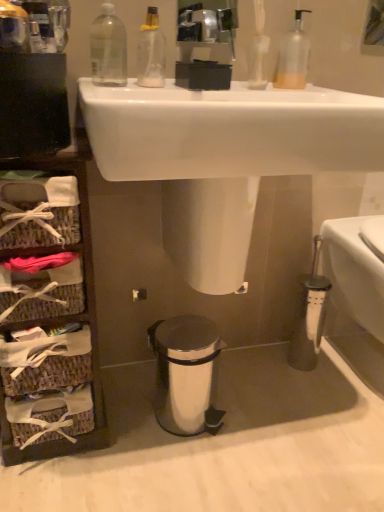
Question: Is translucent plastic soap dispenser at upper center, acting as the first cleaning product starting from the right, in front of or behind clear plastic bottle at upper left in the image?

Choices:
 (A) behind
 (B) front

Answer: (A)

Question: From the image's perspective, is translucent plastic soap dispenser at upper center, acting as the first cleaning product starting from the right, above or below clear plastic bottle at upper left?

Choices:
 (A) below
 (B) above

Answer: (B)

Question: Considering the real-world distances, which object is farthest from the white glossy sink at upper center?

Choices:
 (A) transparent plastic bottle at upper center, arranged as the 2th cleaning product when viewed from the right
 (B) translucent plastic soap dispenser at upper center, which ranks as the second cleaning product in left-to-right order
 (C) white glossy toilet bowl at right
 (D) metallic mirror at upper center
 (E) silver metallic trash can at lower center

Answer: (C)

Question: Which object is positioned farthest from the white glossy toilet bowl at right?

Choices:
 (A) transparent plastic bottle at upper center, the first cleaning product positioned from the left
 (B) translucent plastic soap dispenser at upper center, acting as the first cleaning product starting from the right
 (C) woven brown basket at left
 (D) metallic mirror at upper center
 (E) white glossy sink at upper center

Answer: (C)